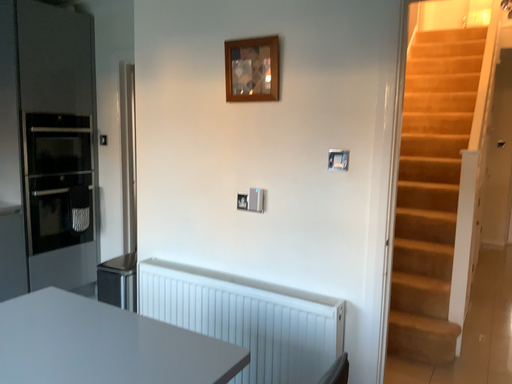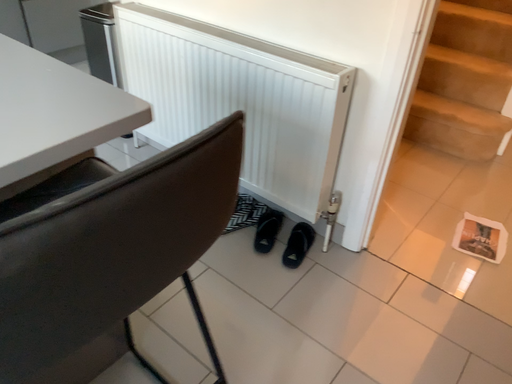
Question: How did the camera likely rotate when shooting the video?

Choices:
 (A) rotated right
 (B) rotated left

Answer: (B)